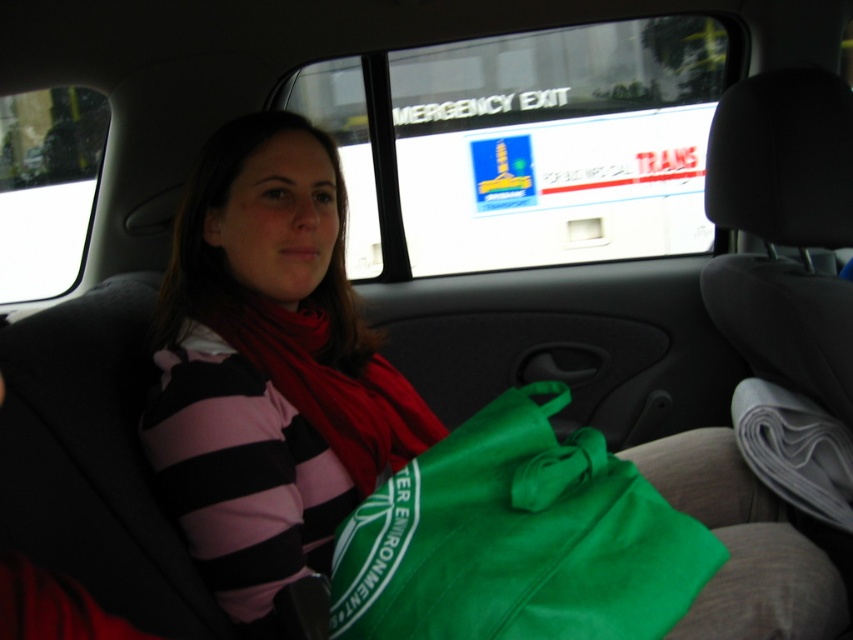
Is striped cotton shirt at center positioned behind red soft scarf at center?

That is False.

This screenshot has height=640, width=853. Find the location of `striped cotton shirt at center`. striped cotton shirt at center is located at coordinates (268, 368).

Between striped cotton shirt at center and green fabric bag at center, which one appears on the right side from the viewer's perspective?

green fabric bag at center is more to the right.

Is point (292, 230) positioned after point (657, 557)?

Yes.

Image resolution: width=853 pixels, height=640 pixels. Find the location of `striped cotton shirt at center`. striped cotton shirt at center is located at coordinates (268, 368).

You are a GUI agent. You are given a task and a screenshot of the screen. Output one action in this format:
    pyautogui.click(x=<x>, y=<y>)
    Task: Click on the striped cotton shirt at center
    
    Given the screenshot: What is the action you would take?
    pyautogui.click(x=268, y=368)

Which is below, green fabric bag at center or red soft scarf at center?

green fabric bag at center is lower down.

Between point (581, 556) and point (325, 436), which one is positioned behind?

Point (325, 436)

Find the location of `green fabric bag at center`. green fabric bag at center is located at coordinates (x=517, y=538).

Identify the location of green fabric bag at center. The height and width of the screenshot is (640, 853). coord(517,538).